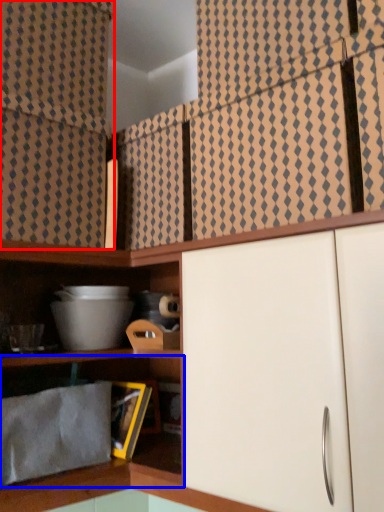
Question: Which object appears farthest to the camera in this image, curtain (highlighted by a red box) or shelf (highlighted by a blue box)?

Choices:
 (A) curtain
 (B) shelf

Answer: (A)